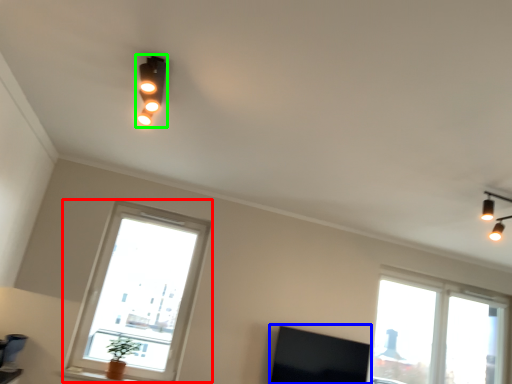
Question: Considering the real-world distances, which object is farthest from window (highlighted by a red box)? window screen (highlighted by a blue box) or lamp (highlighted by a green box)?

Choices:
 (A) window screen
 (B) lamp

Answer: (B)